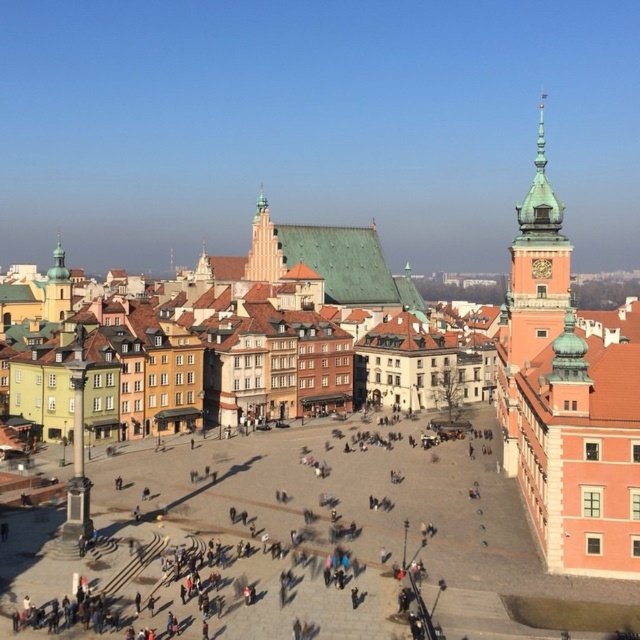
Question: Is green matte tower at upper right bigger than light beige stone tower at center?

Choices:
 (A) no
 (B) yes

Answer: (B)

Question: Can you confirm if green matte tower at upper right is positioned below light beige stone tower at center?

Choices:
 (A) no
 (B) yes

Answer: (B)

Question: Which point is farther to the camera?

Choices:
 (A) (266, 273)
 (B) (524, 289)

Answer: (A)

Question: Among these objects, which one is nearest to the camera?

Choices:
 (A) light beige stone tower at center
 (B) green matte tower at upper right

Answer: (B)

Question: Can you confirm if green matte tower at upper right is positioned above light beige stone tower at center?

Choices:
 (A) no
 (B) yes

Answer: (A)